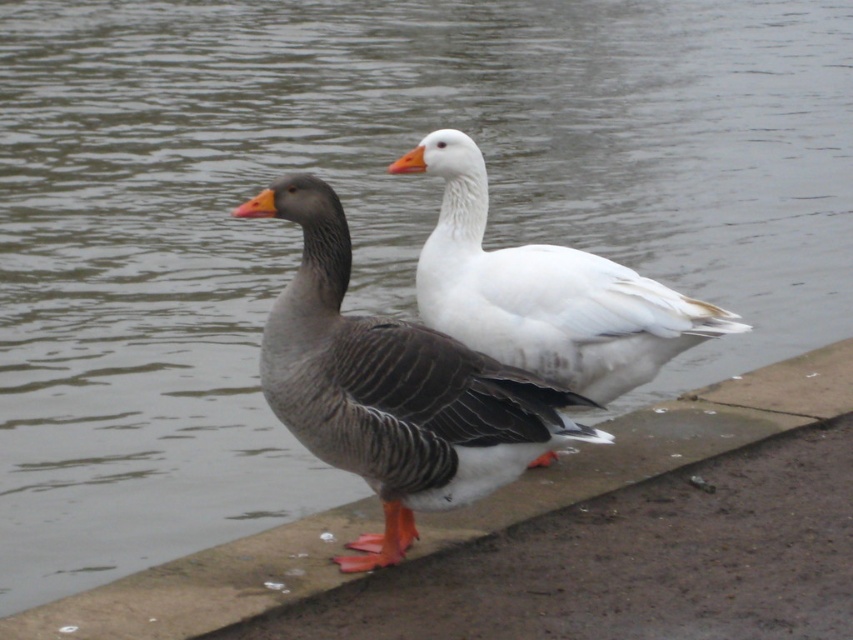
Question: Which point is closer to the camera?

Choices:
 (A) concrete at center
 (B) white matte goose at center
 (C) gray matte duck at center

Answer: (C)

Question: Is gray matte duck at center to the right of concrete at center from the viewer's perspective?

Choices:
 (A) yes
 (B) no

Answer: (B)

Question: Is the position of gray matte duck at center more distant than that of white matte goose at center?

Choices:
 (A) no
 (B) yes

Answer: (A)

Question: Estimate the real-world distances between objects in this image. Which object is farther from the concrete at center?

Choices:
 (A) white matte goose at center
 (B) gray matte duck at center

Answer: (B)

Question: Where is gray matte duck at center located in relation to concrete at center in the image?

Choices:
 (A) right
 (B) left

Answer: (B)

Question: Which object appears farthest from the camera in this image?

Choices:
 (A) concrete at center
 (B) gray matte duck at center

Answer: (A)